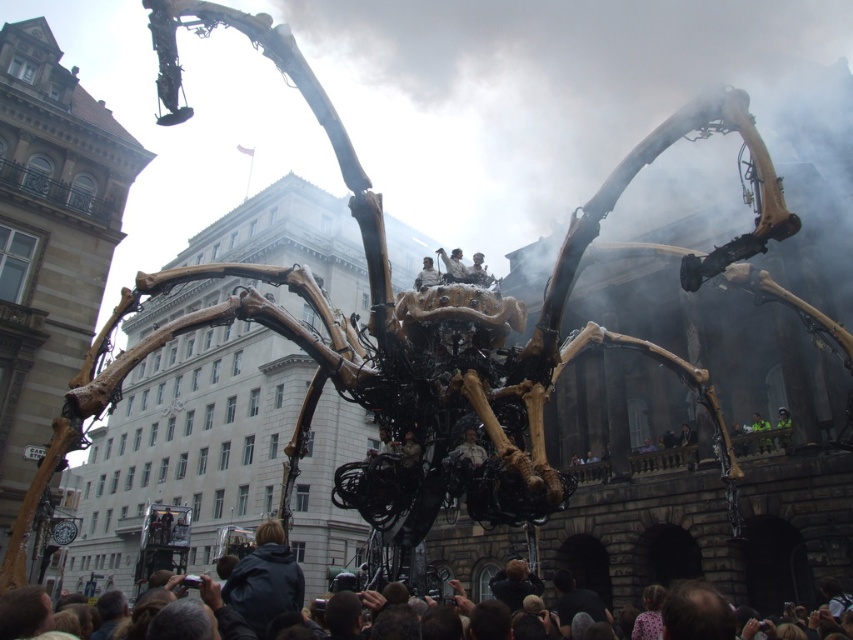
Question: Is white fabric person at center to the right of wooden figure at center from the viewer's perspective?

Choices:
 (A) no
 (B) yes

Answer: (B)

Question: Which point appears farthest from the camera in this image?

Choices:
 (A) (758, 428)
 (B) (782, 444)
 (C) (164, 621)
 (D) (424, 266)

Answer: (A)

Question: Can you confirm if dark blue jacket at lower center is thinner than smooth brown fur at center?

Choices:
 (A) yes
 (B) no

Answer: (B)

Question: Is wooden figure at center below light brown leather jacket at center?

Choices:
 (A) yes
 (B) no

Answer: (A)

Question: Among these points, which one is farthest from the camera?

Choices:
 (A) (299, 570)
 (B) (434, 272)
 (C) (473, 435)
 (D) (766, 422)

Answer: (D)

Question: Which object is the closest to the wooden figure at center?

Choices:
 (A) light brown leather jacket at center
 (B) white fabric person at center

Answer: (A)